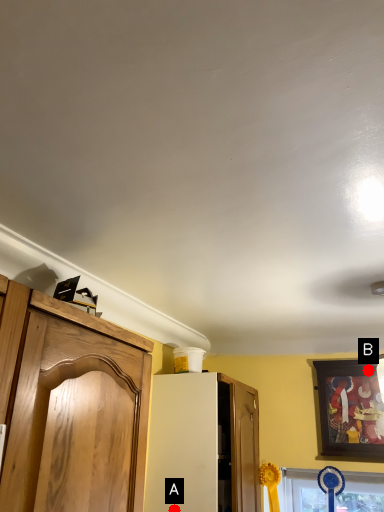
Question: Two points are circled on the image, labeled by A and B beside each circle. Which point is closer to the camera?

Choices:
 (A) A is closer
 (B) B is closer

Answer: (A)